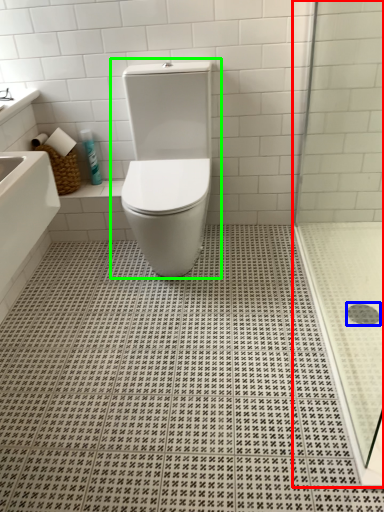
Question: Estimate the real-world distances between objects in this image. Which object is farther from shower door (highlighted by a red box), drain (highlighted by a blue box) or toilet (highlighted by a green box)?

Choices:
 (A) drain
 (B) toilet

Answer: (A)